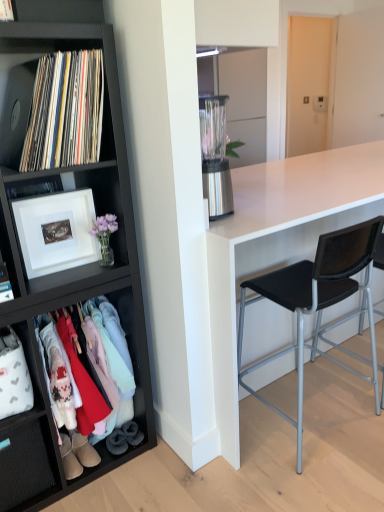
The height and width of the screenshot is (512, 384). In order to click on free space on the front side of black mesh chair at right, the second chair viewed from the right in this screenshot , I will do `click(309, 478)`.